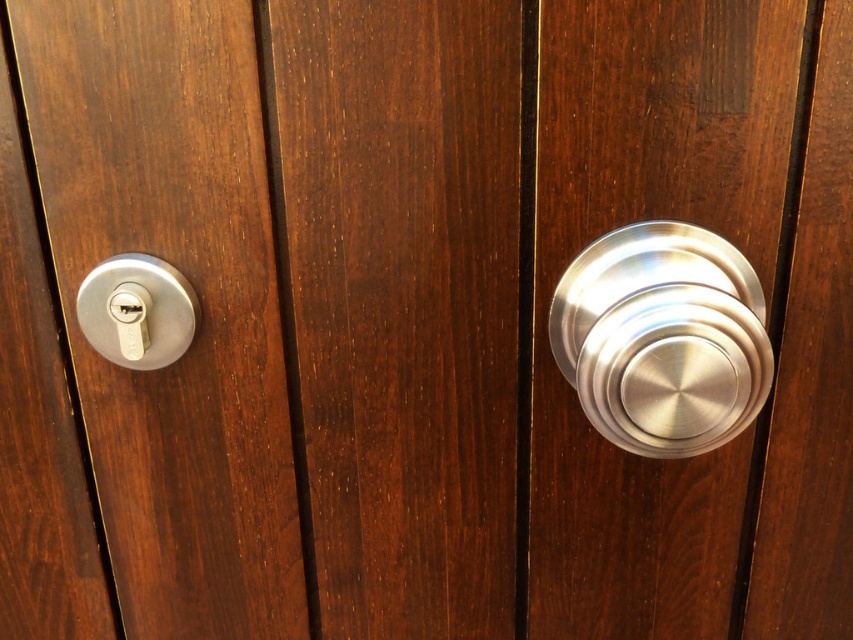
You are a locksmith examining a door with two locks. You have a satin nickel lock at left and a matte silver lock at left. Which lock should you adjust first if you need to work on the larger one?

The satin nickel lock at left is larger in size than the matte silver lock at left, so you should adjust the satin nickel lock at left first.

You are a locksmith examining a door with two locks. You need to determine which lock is taller. The locks are the satin nickel lock at left and the matte silver lock at left. Which one has a greater height?

The satin nickel lock at left has a greater height compared to the matte silver lock at left.